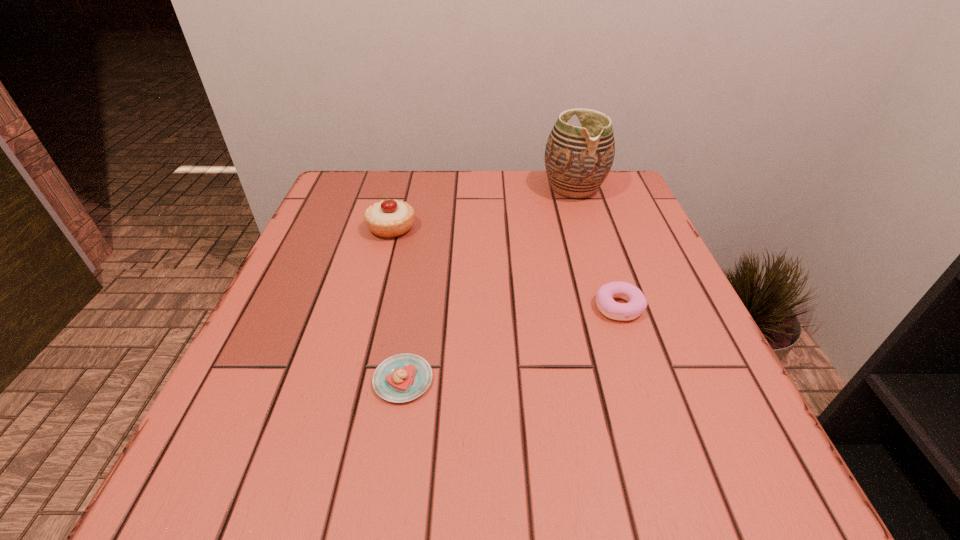
Find the location of a particular element. vacant position located 0.180m on the left of the second tallest pastry is located at coordinates (496, 307).

This screenshot has height=540, width=960. Identify the location of vacant space situated on the left of the shortest object. pyautogui.click(x=265, y=380).

The height and width of the screenshot is (540, 960). I want to click on pottery situated at the far edge, so click(x=578, y=159).

Locate an element on the screen. pastry that is at the far edge is located at coordinates point(391,218).

Locate an element on the screen. object present at the left edge is located at coordinates (391, 218).

Find the location of a particular element. The image size is (960, 540). pottery that is at the right edge is located at coordinates (578, 159).

Identify the location of pastry at the right edge. (637, 303).

This screenshot has height=540, width=960. I want to click on object situated at the far left corner, so click(x=391, y=218).

This screenshot has height=540, width=960. What are the coordinates of `object at the far right corner` in the screenshot? It's located at (578, 159).

Identify the location of vacant space at the far edge of the desktop. The height and width of the screenshot is (540, 960). (478, 190).